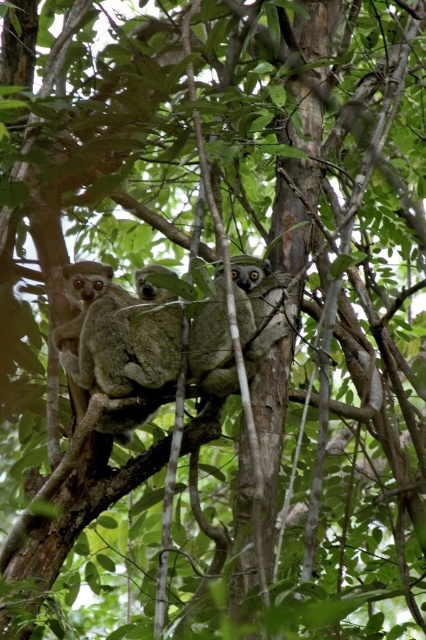
In the image of the tree with lemurs, there are two animals visible. One is the soft brown fur at left and the other is the gray furry koala at center. Which of these two animals is positioned more to the left side of the image?

The soft brown fur at left is positioned more to the left side of the image compared to the gray furry koala at center.

You are an animal researcher observing the lemurs in the tree. You notice two animals in the scene. One has soft brown fur at left and the other is a gray furry koala at center. Which animal is positioned higher up in the tree?

The soft brown fur at left is taller than the gray furry koala at center, so the animal with soft brown fur at left is positioned higher up in the tree.

You are a wildlife photographer trying to capture a closeup of the soft brown fur at left and the gray furry koala at center. Which animal should you focus on first if you want to photograph the larger one?

The soft brown fur at left is larger in size than the gray furry koala at center, so you should focus on the soft brown fur at left first.